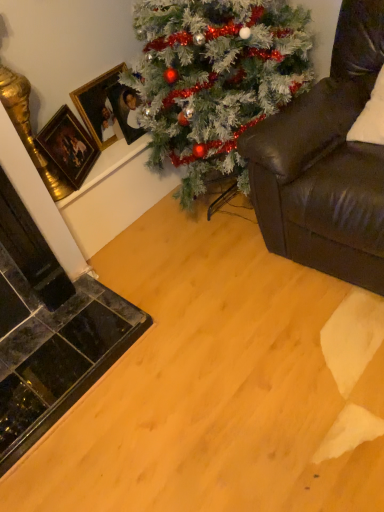
Find the location of a particular element. The image size is (384, 512). gold-framed picture at upper left, which appears as the first picture frame when viewed from the right is located at coordinates (126, 110).

Describe the element at coordinates (126, 110) in the screenshot. The height and width of the screenshot is (512, 384). I see `gold-framed picture at upper left, which appears as the first picture frame when viewed from the right` at that location.

Identify the location of gold-framed picture at upper left, which ranks as the 2th picture frame in left-to-right order. (109, 108).

What are the coordinates of `green matte christmas tree at upper center` in the screenshot? It's located at (215, 79).

Identify the location of gold/gilded picture frame at upper left, which is counted as the 1th picture frame, starting from the left. The height and width of the screenshot is (512, 384). click(x=69, y=146).

At what (x,y) coordinates should I click in order to perform the action: click on gold-framed picture at upper left, which appears as the first picture frame when viewed from the right. Please return your answer as a coordinate pair (x, y). The width and height of the screenshot is (384, 512). Looking at the image, I should click on pos(126,110).

Is point (311, 228) closer or farther from the camera than point (130, 115)?

Point (311, 228).

In the image, there is a gold-framed picture at upper left, which appears as the first picture frame when viewed from the right. What are the coordinates of `studio couch below it (from the image's perspective)` in the screenshot? It's located at (326, 163).

Based on the photo, from the image's perspective, is leather couch at right positioned above or below gold-framed picture at upper left, which appears as the first picture frame when viewed from the right?

leather couch at right is below gold-framed picture at upper left, which appears as the first picture frame when viewed from the right.

Which object is closer to the camera, leather couch at right or gold-framed picture at upper left, the 3th picture frame positioned from the left?

Positioned in front is leather couch at right.

Is point (346, 227) more distant than point (90, 159)?

No, it is not.

From the image's perspective, relative to gold/gilded picture frame at upper left, which is counted as the 1th picture frame, starting from the left, is leather couch at right above or below?

From the image's perspective, leather couch at right appears above gold/gilded picture frame at upper left, which is counted as the 1th picture frame, starting from the left.

Considering the relative sizes of leather couch at right and gold/gilded picture frame at upper left, which is counted as the 1th picture frame, starting from the left, in the image provided, is leather couch at right smaller than gold/gilded picture frame at upper left, which is counted as the 1th picture frame, starting from the left,?

Actually, leather couch at right might be larger than gold/gilded picture frame at upper left, which is counted as the 1th picture frame, starting from the left.

Is point (358, 257) less distant than point (232, 52)?

Yes, point (358, 257) is closer to viewer.

There is a leather couch at right. In order to click on christmas tree above it (from a real-world perspective) in this screenshot , I will do `click(215, 79)`.

Between leather couch at right and green matte christmas tree at upper center, which one appears on the left side from the viewer's perspective?

green matte christmas tree at upper center is more to the left.

Can you tell me how much gold-framed picture at upper left, the second picture frame positioned from the right, and gold/gilded picture frame at upper left, which is counted as the 1th picture frame, starting from the left, differ in facing direction?

31.8 degrees separate the facing orientations of gold-framed picture at upper left, the second picture frame positioned from the right, and gold/gilded picture frame at upper left, which is counted as the 1th picture frame, starting from the left.

Which is farther from the camera, (112, 101) or (65, 170)?

The point (112, 101) is farther.

From a real-world perspective, is gold-framed picture at upper left, which ranks as the 2th picture frame in left-to-right order, positioned above or below gold/gilded picture frame at upper left, the third picture frame in the right-to-left sequence?

Clearly, from a real-world perspective, gold-framed picture at upper left, which ranks as the 2th picture frame in left-to-right order, is above gold/gilded picture frame at upper left, the third picture frame in the right-to-left sequence.

Who is shorter, gold-framed picture at upper left, which ranks as the 2th picture frame in left-to-right order, or gold/gilded picture frame at upper left, which is counted as the 1th picture frame, starting from the left?

gold-framed picture at upper left, which ranks as the 2th picture frame in left-to-right order.

Is leather couch at right outside of gold-framed picture at upper left, the second picture frame positioned from the right?

leather couch at right is positioned outside gold-framed picture at upper left, the second picture frame positioned from the right.

What's the angular difference between leather couch at right and gold-framed picture at upper left, the second picture frame positioned from the right,'s facing directions?

90.9 degrees.

Which of these two, leather couch at right or gold-framed picture at upper left, which ranks as the 2th picture frame in left-to-right order, is wider?

leather couch at right is wider.

Is leather couch at right inside gold-framed picture at upper left, which ranks as the 2th picture frame in left-to-right order?

No, leather couch at right is located outside of gold-framed picture at upper left, which ranks as the 2th picture frame in left-to-right order.

Which object is positioned more to the left, gold-framed picture at upper left, which ranks as the 2th picture frame in left-to-right order, or leather couch at right?

gold-framed picture at upper left, which ranks as the 2th picture frame in left-to-right order, is more to the left.

Are gold-framed picture at upper left, which ranks as the 2th picture frame in left-to-right order, and leather couch at right far apart?

That's not correct — gold-framed picture at upper left, which ranks as the 2th picture frame in left-to-right order, is a little close to leather couch at right.

Could you tell me if gold-framed picture at upper left, which ranks as the 2th picture frame in left-to-right order, is facing leather couch at right?

Yes, gold-framed picture at upper left, which ranks as the 2th picture frame in left-to-right order, faces towards leather couch at right.

From their relative heights in the image, would you say gold-framed picture at upper left, which ranks as the 2th picture frame in left-to-right order, is taller or shorter than gold-framed picture at upper left, which appears as the first picture frame when viewed from the right?

In the image, gold-framed picture at upper left, which ranks as the 2th picture frame in left-to-right order, appears to be taller than gold-framed picture at upper left, which appears as the first picture frame when viewed from the right.

From the image's perspective, is gold-framed picture at upper left, the second picture frame positioned from the right, on top of gold-framed picture at upper left, the 3th picture frame positioned from the left?

Yes, from the image's perspective, gold-framed picture at upper left, the second picture frame positioned from the right, is on top of gold-framed picture at upper left, the 3th picture frame positioned from the left.

Does point (87, 92) come behind point (127, 127)?

Yes.

At what (x,y) coordinates should I click in order to perform the action: click on picture frame that is the 1st one below the gold-framed picture at upper left, the second picture frame positioned from the right (from a real-world perspective). Please return your answer as a coordinate pair (x, y). Image resolution: width=384 pixels, height=512 pixels. Looking at the image, I should click on (126, 110).

Find the location of a particular element. Image resolution: width=384 pixels, height=512 pixels. studio couch that appears on the right of gold-framed picture at upper left, which appears as the first picture frame when viewed from the right is located at coordinates (326, 163).

The width and height of the screenshot is (384, 512). I want to click on the 3rd picture frame to the left when counting from the leather couch at right, so click(69, 146).

Which object lies nearer to the anchor point gold/gilded picture frame at upper left, which is counted as the 1th picture frame, starting from the left, leather couch at right or gold-framed picture at upper left, the second picture frame positioned from the right?

gold-framed picture at upper left, the second picture frame positioned from the right, lies closer to gold/gilded picture frame at upper left, which is counted as the 1th picture frame, starting from the left, than the other object.

Which object lies further to the anchor point gold-framed picture at upper left, the 3th picture frame positioned from the left, gold/gilded picture frame at upper left, which is counted as the 1th picture frame, starting from the left, or gold-framed picture at upper left, which ranks as the 2th picture frame in left-to-right order?

Among the two, gold/gilded picture frame at upper left, which is counted as the 1th picture frame, starting from the left, is located further to gold-framed picture at upper left, the 3th picture frame positioned from the left.

Consider the image. From the image, which object appears to be nearer to leather couch at right, gold/gilded picture frame at upper left, which is counted as the 1th picture frame, starting from the left, or green matte christmas tree at upper center?

Among the two, green matte christmas tree at upper center is located nearer to leather couch at right.

When comparing their distances from leather couch at right, does gold/gilded picture frame at upper left, the third picture frame in the right-to-left sequence, or gold-framed picture at upper left, the second picture frame positioned from the right, seem further?

The object further to leather couch at right is gold/gilded picture frame at upper left, the third picture frame in the right-to-left sequence.

Considering their positions, is green matte christmas tree at upper center positioned closer to leather couch at right than gold-framed picture at upper left, the second picture frame positioned from the right?

green matte christmas tree at upper center is closer to leather couch at right.

Based on their spatial positions, is leather couch at right or gold-framed picture at upper left, the second picture frame positioned from the right, further from green matte christmas tree at upper center?

The object further to green matte christmas tree at upper center is gold-framed picture at upper left, the second picture frame positioned from the right.

Looking at the image, which one is located further to leather couch at right, gold-framed picture at upper left, which ranks as the 2th picture frame in left-to-right order, or gold/gilded picture frame at upper left, the third picture frame in the right-to-left sequence?

Among the two, gold/gilded picture frame at upper left, the third picture frame in the right-to-left sequence, is located further to leather couch at right.

From the image, which object appears to be nearer to gold/gilded picture frame at upper left, which is counted as the 1th picture frame, starting from the left, gold-framed picture at upper left, the second picture frame positioned from the right, or leather couch at right?

The object closer to gold/gilded picture frame at upper left, which is counted as the 1th picture frame, starting from the left, is gold-framed picture at upper left, the second picture frame positioned from the right.

Image resolution: width=384 pixels, height=512 pixels. Find the location of `christmas tree located between leather couch at right and gold-framed picture at upper left, the second picture frame positioned from the right, in the depth direction`. christmas tree located between leather couch at right and gold-framed picture at upper left, the second picture frame positioned from the right, in the depth direction is located at coordinates (215, 79).

This screenshot has width=384, height=512. In order to click on picture frame positioned between gold/gilded picture frame at upper left, the third picture frame in the right-to-left sequence, and gold-framed picture at upper left, which appears as the first picture frame when viewed from the right, from near to far in this screenshot , I will do `click(109, 108)`.

I want to click on christmas tree positioned between leather couch at right and gold-framed picture at upper left, which appears as the first picture frame when viewed from the right, from near to far, so [x=215, y=79].

Locate an element on the screen. This screenshot has height=512, width=384. christmas tree situated between gold/gilded picture frame at upper left, the third picture frame in the right-to-left sequence, and leather couch at right from left to right is located at coordinates (215, 79).